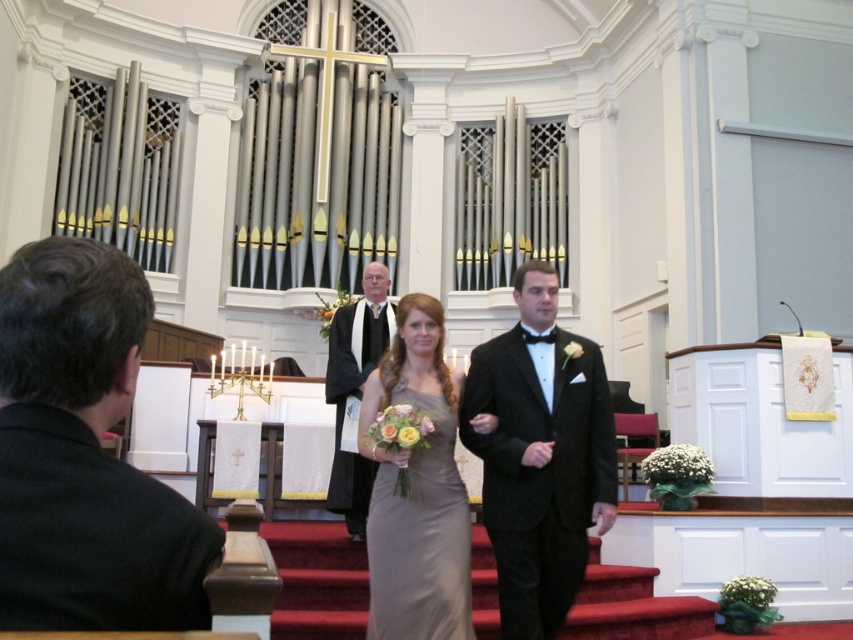
Question: Is black fabric suit at left to the right of black satin tuxedo at center from the viewer's perspective?

Choices:
 (A) no
 (B) yes

Answer: (A)

Question: Based on their relative distances, which object is nearer to the satin dress at center?

Choices:
 (A) black satin tuxedo at center
 (B) white silk robe at center

Answer: (A)

Question: Does satin dress at center lie behind white silk robe at center?

Choices:
 (A) no
 (B) yes

Answer: (A)

Question: Does satin dress at center appear on the left side of white silk robe at center?

Choices:
 (A) yes
 (B) no

Answer: (B)

Question: Which point is farther to the camera?

Choices:
 (A) click(x=445, y=465)
 (B) click(x=334, y=385)

Answer: (B)

Question: Estimate the real-world distances between objects in this image. Which object is farther from the white silk robe at center?

Choices:
 (A) black satin tuxedo at center
 (B) satin dress at center

Answer: (A)